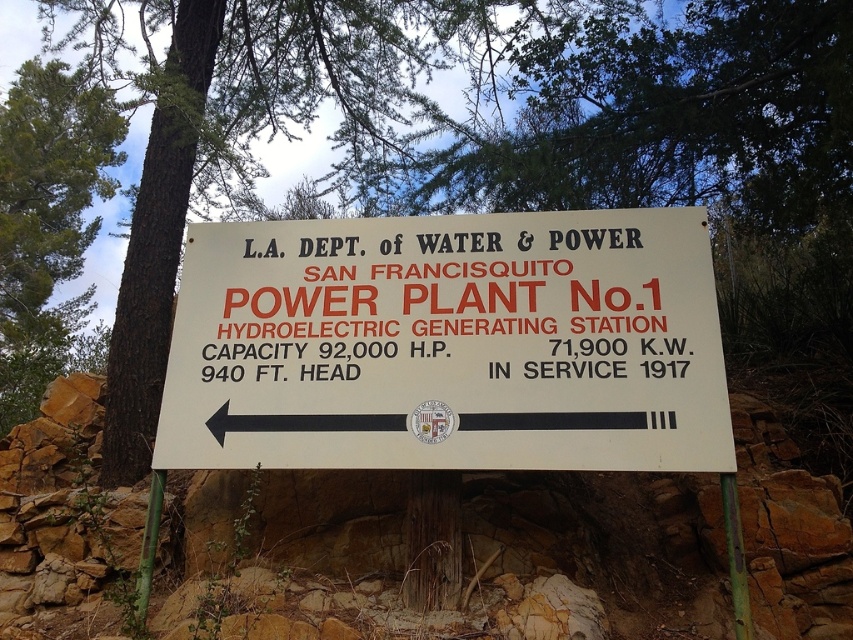
Between green leafy tree at upper center and green textured bark at upper left, which one has more height?

Standing taller between the two is green textured bark at upper left.

Does point (218, 74) come closer to viewer compared to point (88, 125)?

That is True.

Find the location of `green leafy tree at upper center`. green leafy tree at upper center is located at coordinates (251, 128).

Can you confirm if white matte sign at center is taller than green textured bark at upper left?

In fact, white matte sign at center may be shorter than green textured bark at upper left.

Between point (416, 392) and point (18, 224), which one is positioned in front?

Point (416, 392) is more forward.

Who is more distant from viewer, (364, 225) or (19, 84)?

The point (19, 84) is behind.

You are a GUI agent. You are given a task and a screenshot of the screen. Output one action in this format:
    pyautogui.click(x=<x>, y=<y>)
    Task: Click on the white matte sign at center
    
    Given the screenshot: What is the action you would take?
    pyautogui.click(x=448, y=344)

Which is more to the left, white matte sign at center or green leafy tree at upper center?

green leafy tree at upper center

Can you confirm if white matte sign at center is thinner than green leafy tree at upper center?

Indeed, white matte sign at center has a lesser width compared to green leafy tree at upper center.

Image resolution: width=853 pixels, height=640 pixels. Describe the element at coordinates (448, 344) in the screenshot. I see `white matte sign at center` at that location.

This screenshot has height=640, width=853. Identify the location of white matte sign at center. [448, 344].